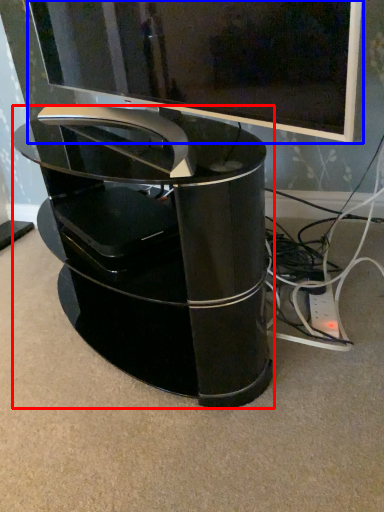
Question: Which object appears farthest to the camera in this image, furniture (highlighted by a red box) or television (highlighted by a blue box)?

Choices:
 (A) furniture
 (B) television

Answer: (A)